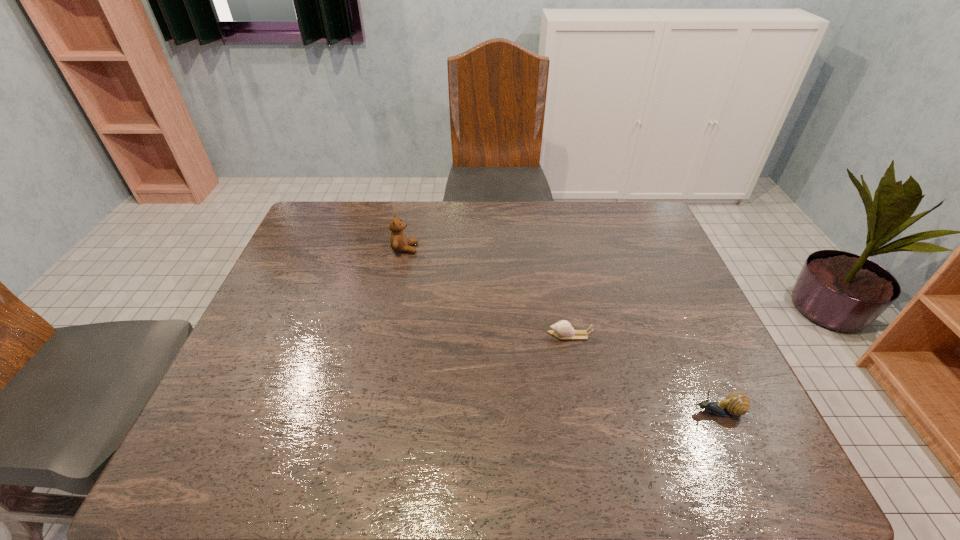
At what (x,y) coordinates should I click in order to perform the action: click on vacant space located on the shell of the shortest object. Please return your answer as a coordinate pair (x, y). This screenshot has height=540, width=960. Looking at the image, I should click on (440, 335).

You are a GUI agent. You are given a task and a screenshot of the screen. Output one action in this format:
    pyautogui.click(x=<x>, y=<y>)
    Task: Click on the vacant space positioned 0.270m on the shell of the shortest object
    This screenshot has height=540, width=960.
    Given the screenshot: What is the action you would take?
    pyautogui.click(x=440, y=335)

This screenshot has width=960, height=540. In order to click on vacant space located 0.240m on the shell of the shortest object in this screenshot , I will do `click(451, 335)`.

Find the location of `object present at the far edge`. object present at the far edge is located at coordinates (398, 240).

Where is `object present at the right edge`? This screenshot has width=960, height=540. object present at the right edge is located at coordinates (736, 404).

The image size is (960, 540). In order to click on vacant area at the far edge in this screenshot , I will do `click(555, 215)`.

In the image, there is a desktop. Where is `vacant region at the near edge`? The image size is (960, 540). vacant region at the near edge is located at coordinates (362, 447).

The image size is (960, 540). In the image, there is a desktop. Find the location of `vacant space at the left edge`. vacant space at the left edge is located at coordinates (342, 245).

Locate an element on the screen. free space at the right edge is located at coordinates (638, 289).

Image resolution: width=960 pixels, height=540 pixels. In the image, there is a desktop. Find the location of `vacant space at the far left corner`. vacant space at the far left corner is located at coordinates (341, 219).